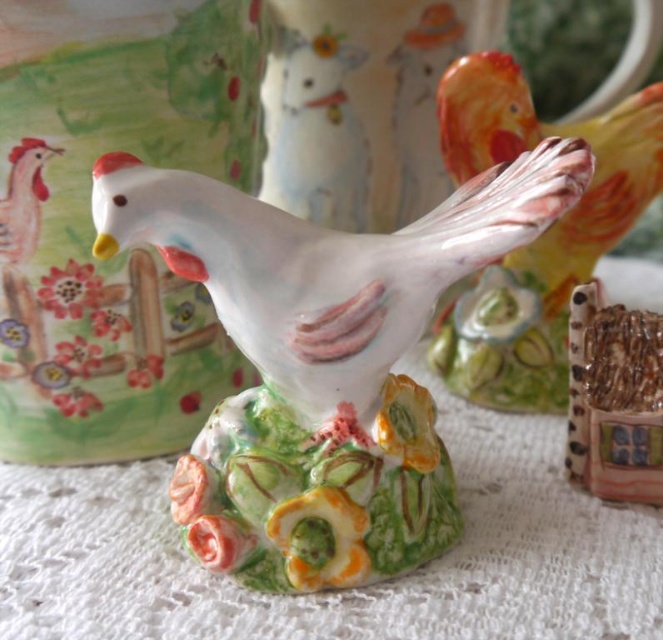
You are an art curator examining a new ceramic figurine. The figurine has a decorative base with floral motifs. There is a point at coordinates [324,362] in the image. What object is located at this specific coordinate?

The white glossy ceramic chicken at center is located at point [324,362].

You are an art collector examining two chickens in an art gallery. You see a white glossy ceramic chicken at center and a porcelain glossy chicken at upper right. Which chicken is nearer to you?

The white glossy ceramic chicken at center is closer to the viewer than the porcelain glossy chicken at upper right, so the white glossy ceramic chicken at center is nearer to you.

You are an art curator arranging a display. You need to ensure that the white glossy ceramic chicken at center and the porcelain glossy chicken at upper right are positioned correctly according to their spatial relationship. Which chicken should be placed lower in the display?

The white glossy ceramic chicken at center should be placed lower because it is positioned below the porcelain glossy chicken at upper right.